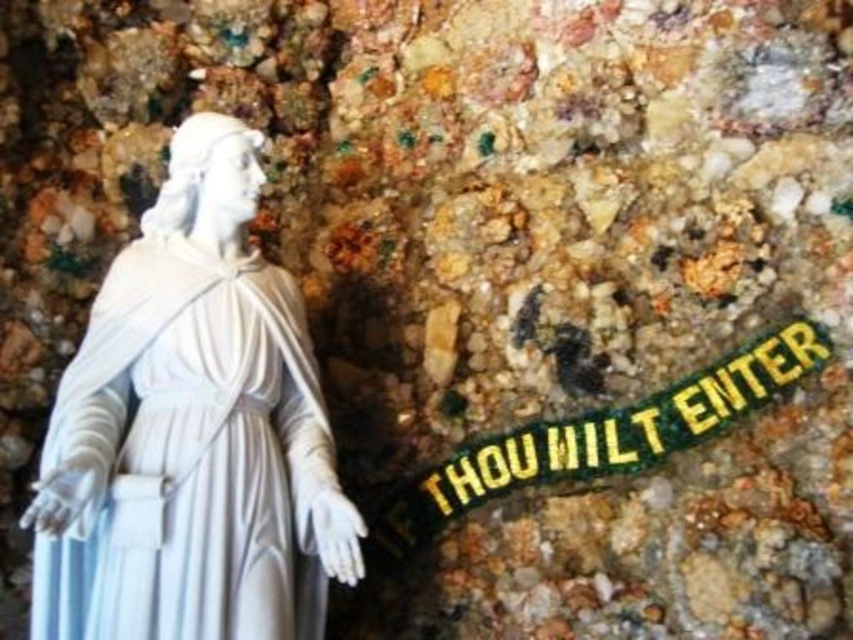
From the picture: You are standing in front of a statue and a textured stone wall. You notice a point marked at coordinates (x=192, y=432). What object is located at that point?

The white marble statue at left is located at point (x=192, y=432).